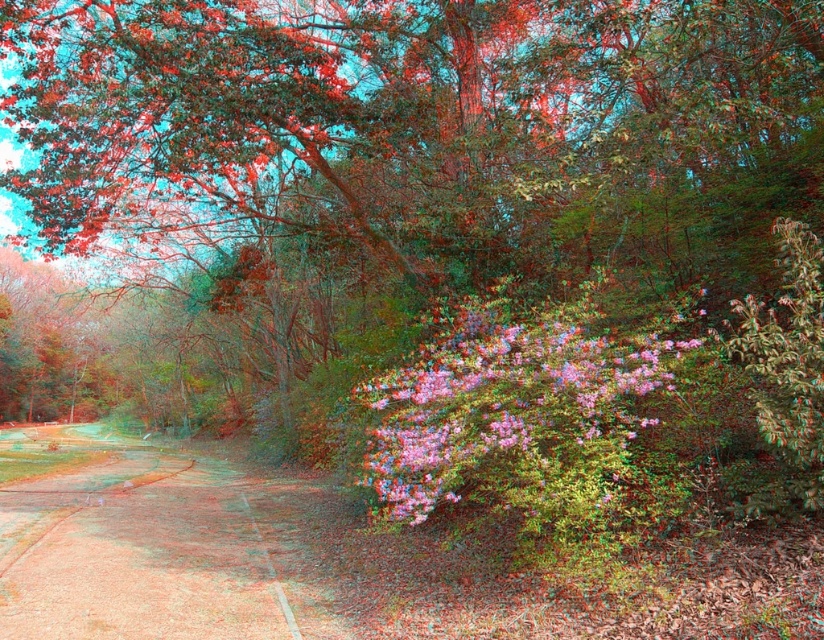
You are standing at the center of the image and want to walk to the brown dirt path at lower left. According to the scene description, in which direction should you move to reach it?

The brown dirt path at lower left is located at point [162,544], so you should move towards the lower left direction to reach it.

You are a gardener planning to plant a new flower bed along the brown dirt path at lower left and the pink textured bush at center. Considering their heights, which object should you place taller plants near to ensure they don not block the view of the shorter one?

The brown dirt path at lower left is taller than the pink textured bush at center. Therefore, you should place taller plants near the pink textured bush at center so they do not block the view of the shorter pink textured bush at center.